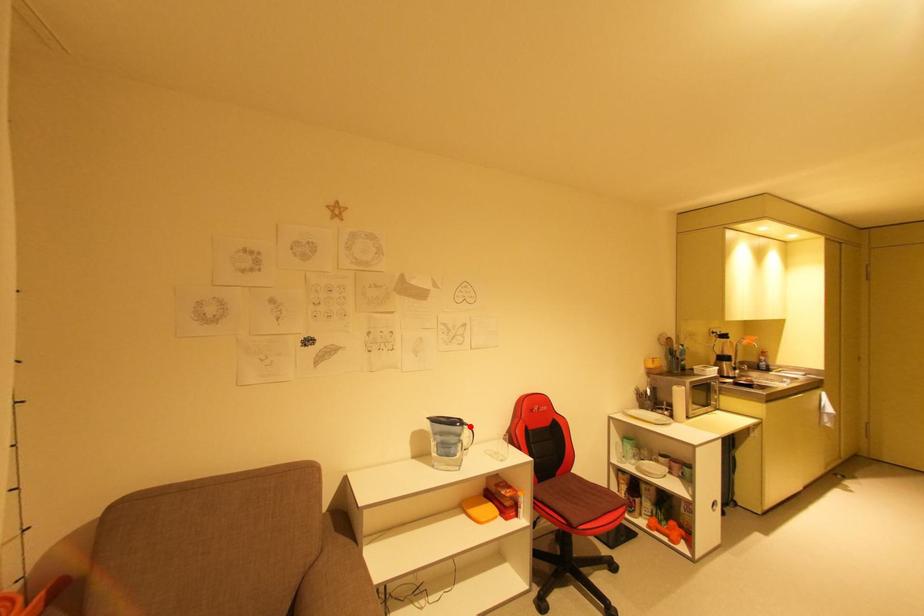
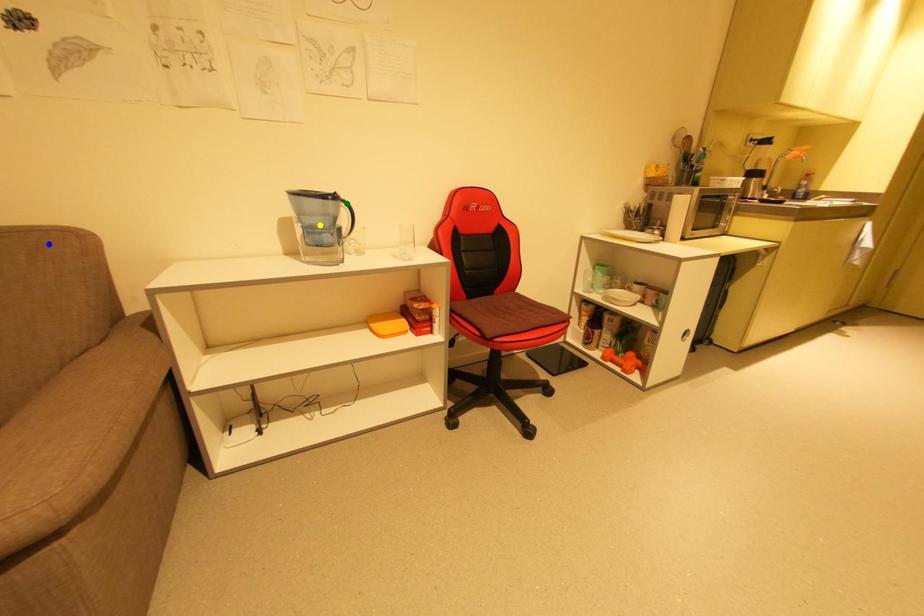
Question: I am providing you with two images of the same scene from different viewpoints. A red point is marked on the first image. You are given multiple points on the second image. In image 2, which mark is for the same physical point as the one in image 1?

Choices:
 (A) green point
 (B) blue point
 (C) yellow point

Answer: (A)